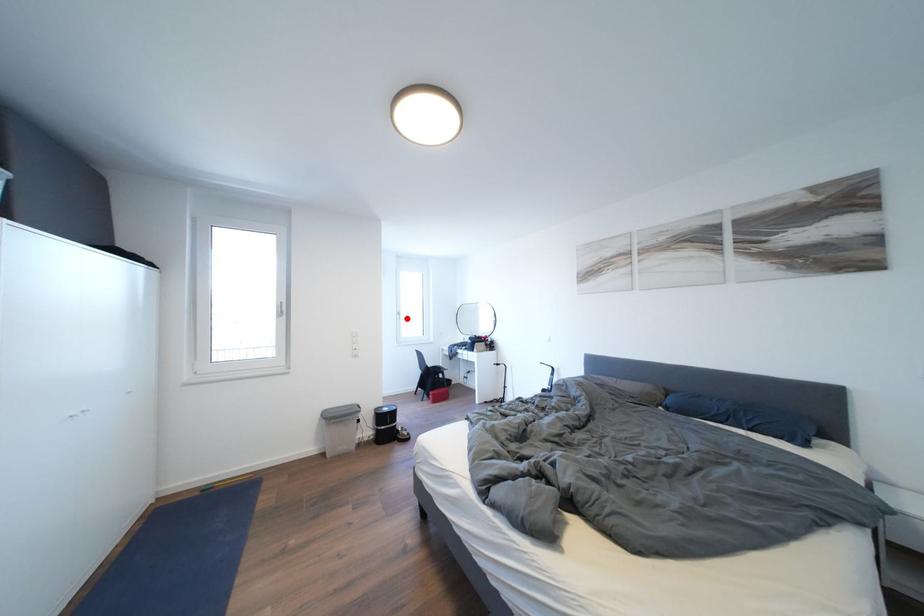
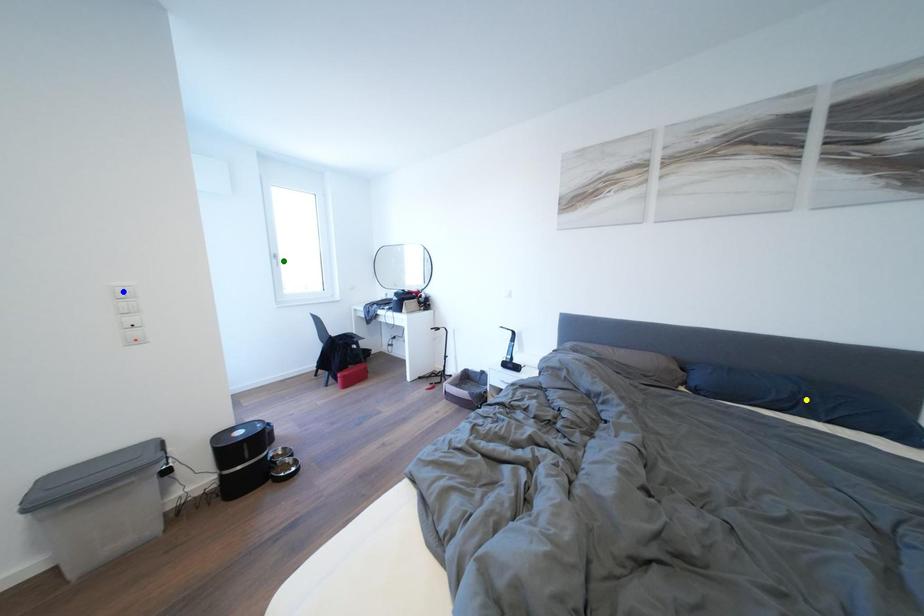
Question: I am providing you with two images of the same scene from different viewpoints. A red point is marked on the first image. You are given multiple points on the second image. Which point in image 2 is actually the same real-world point as the red point in image 1?

Choices:
 (A) green point
 (B) yellow point
 (C) blue point

Answer: (A)